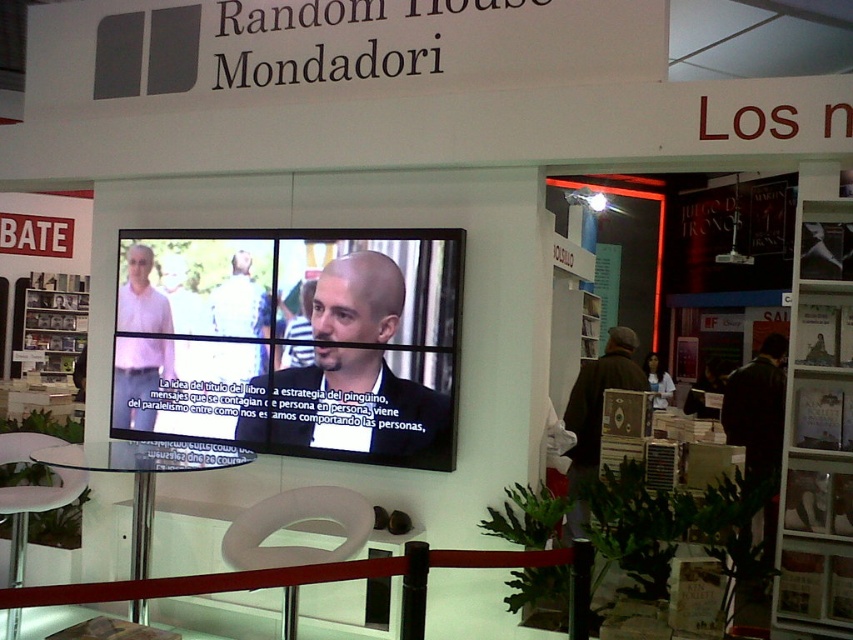
Question: Which point appears closest to the camera in this image?

Choices:
 (A) coord(581,451)
 (B) coord(163,330)

Answer: (B)

Question: Which point is closer to the camera?

Choices:
 (A) (834, 324)
 (B) (252, 416)
 (C) (120, 289)
 (D) (564, 419)

Answer: (A)

Question: Does matte black suit at center appear under matte white shirt at upper left?

Choices:
 (A) no
 (B) yes

Answer: (B)

Question: Which point appears farthest from the camera in this image?

Choices:
 (A) (578, 397)
 (B) (445, 440)
 (C) (164, 364)

Answer: (A)

Question: From the image, what is the correct spatial relationship of matte black suit at center in relation to matte white shirt at upper left?

Choices:
 (A) below
 (B) above

Answer: (A)

Question: Can you confirm if white wood bookshelf at center right is positioned above matte black suit at center?

Choices:
 (A) yes
 (B) no

Answer: (B)